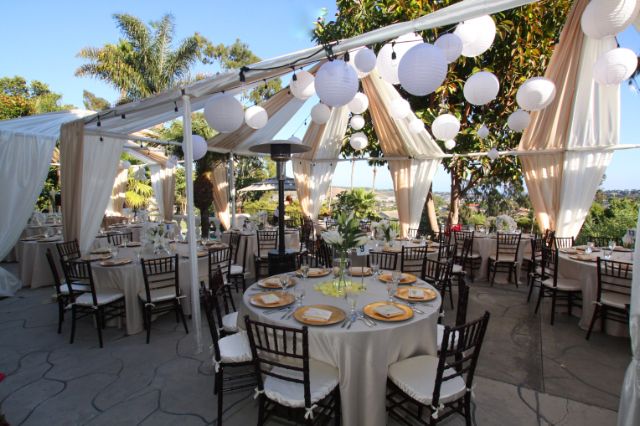
Where is `white curtains`? The height and width of the screenshot is (426, 640). white curtains is located at coordinates (595, 118), (424, 142), (324, 148), (273, 133), (100, 153), (32, 161), (152, 179).